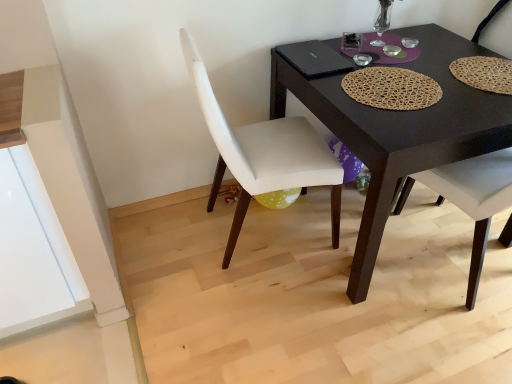
The width and height of the screenshot is (512, 384). Find the location of `unoccupied region to the right of black matte laptop at upper center`. unoccupied region to the right of black matte laptop at upper center is located at coordinates (386, 68).